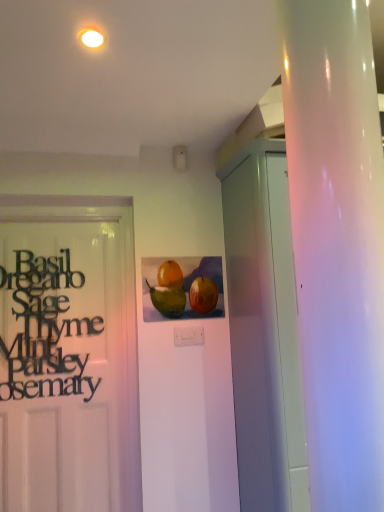
Identify the location of white glossy cabinet at right. pyautogui.click(x=264, y=330).

The width and height of the screenshot is (384, 512). Describe the element at coordinates (43, 328) in the screenshot. I see `black matte sign at left` at that location.

Locate an element on the screen. The height and width of the screenshot is (512, 384). white glossy light fixture at upper center is located at coordinates (92, 38).

The height and width of the screenshot is (512, 384). I want to click on white glossy cabinet at right, so click(264, 330).

Can you see white glossy light fixture at upper center touching white glossy cabinet at right?

white glossy light fixture at upper center and white glossy cabinet at right are not in contact.

The height and width of the screenshot is (512, 384). Identify the location of lighting above the white glossy cabinet at right (from the image's perspective). (92, 38).

From the image's perspective, is white glossy light fixture at upper center above or below white glossy cabinet at right?

white glossy light fixture at upper center is situated higher than white glossy cabinet at right in the image.

Between white glossy cabinet at right and black matte sign at left, which one has smaller width?

black matte sign at left is thinner.

Is white glossy cabinet at right to the left of black matte sign at left from the viewer's perspective?

In fact, white glossy cabinet at right is to the right of black matte sign at left.

Is white glossy cabinet at right positioned with its back to black matte sign at left?

No, white glossy cabinet at right is not facing the opposite direction of black matte sign at left.

Does white glossy cabinet at right have a smaller size compared to black matte sign at left?

No, white glossy cabinet at right is not smaller than black matte sign at left.

Would you say watercolor painting of fruits at center is part of black matte sign at left's contents?

That's incorrect, watercolor painting of fruits at center is not inside black matte sign at left.

Which is closer to the camera, (50, 304) or (183, 298)?

Point (50, 304).

Between black matte sign at left and watercolor painting of fruits at center, which one has smaller width?

With smaller width is black matte sign at left.

How many degrees apart are the facing directions of black matte sign at left and white glossy light fixture at upper center?

There is a 101-degree angle between the facing directions of black matte sign at left and white glossy light fixture at upper center.

Which object is closer to the camera taking this photo, black matte sign at left or white glossy light fixture at upper center?

white glossy light fixture at upper center is closer to the camera.

Is black matte sign at left to the right of white glossy light fixture at upper center from the viewer's perspective?

No, black matte sign at left is not to the right of white glossy light fixture at upper center.

Is black matte sign at left facing away from white glossy light fixture at upper center?

No, black matte sign at left's orientation is not away from white glossy light fixture at upper center.

Could you tell me if black matte sign at left is facing white glossy cabinet at right?

No.

Is the surface of black matte sign at left in direct contact with white glossy cabinet at right?

No, black matte sign at left is not making contact with white glossy cabinet at right.

How distant is black matte sign at left from white glossy cabinet at right?

black matte sign at left is 34.62 inches from white glossy cabinet at right.

Is white glossy cabinet at right inside black matte sign at left?

No, black matte sign at left does not contain white glossy cabinet at right.

From a real-world perspective, is watercolor painting of fruits at center on black matte sign at left?

Correct, in the physical world, watercolor painting of fruits at center is higher than black matte sign at left.

Could you tell me if watercolor painting of fruits at center is turned towards black matte sign at left?

No, watercolor painting of fruits at center is not oriented towards black matte sign at left.

From the image's perspective, is watercolor painting of fruits at center above or below black matte sign at left?

Based on their image positions, watercolor painting of fruits at center is located above black matte sign at left.

Is white glossy cabinet at right positioned beyond the bounds of watercolor painting of fruits at center?

Indeed, white glossy cabinet at right is completely outside watercolor painting of fruits at center.

Which object is positioned more to the left, white glossy cabinet at right or watercolor painting of fruits at center?

watercolor painting of fruits at center.

Could you tell me if white glossy cabinet at right is turned towards watercolor painting of fruits at center?

No, white glossy cabinet at right is not facing towards watercolor painting of fruits at center.

At what (x,y) coordinates should I click in order to perform the action: click on lighting located above the white glossy cabinet at right (from the image's perspective). Please return your answer as a coordinate pair (x, y). Looking at the image, I should click on (92, 38).

This screenshot has height=512, width=384. I want to click on garage door below the black matte sign at left (from the image's perspective), so click(264, 330).

From the picture: Looking at the image, which one is located closer to watercolor painting of fruits at center, white glossy cabinet at right or white glossy light fixture at upper center?

The object closer to watercolor painting of fruits at center is white glossy cabinet at right.

In the scene shown: Looking at the image, which one is located closer to black matte sign at left, watercolor painting of fruits at center or white glossy light fixture at upper center?

watercolor painting of fruits at center is positioned closer to the anchor black matte sign at left.

When comparing their distances from white glossy cabinet at right, does black matte sign at left or white glossy light fixture at upper center seem further?

The object further to white glossy cabinet at right is white glossy light fixture at upper center.

Considering their positions, is watercolor painting of fruits at center positioned closer to white glossy light fixture at upper center than white glossy cabinet at right?

watercolor painting of fruits at center.

Which object lies nearer to the anchor point white glossy light fixture at upper center, white glossy cabinet at right or watercolor painting of fruits at center?

The object closer to white glossy light fixture at upper center is watercolor painting of fruits at center.

When comparing their distances from white glossy light fixture at upper center, does white glossy cabinet at right or black matte sign at left seem closer?

white glossy cabinet at right.

Based on their spatial positions, is white glossy light fixture at upper center or white glossy cabinet at right further from watercolor painting of fruits at center?

The object further to watercolor painting of fruits at center is white glossy light fixture at upper center.

Considering their positions, is watercolor painting of fruits at center positioned closer to white glossy light fixture at upper center than black matte sign at left?

watercolor painting of fruits at center is closer to white glossy light fixture at upper center.

Locate an element on the screen. This screenshot has width=384, height=512. fruit between white glossy light fixture at upper center and black matte sign at left from top to bottom is located at coordinates (183, 288).

This screenshot has height=512, width=384. Identify the location of fruit between black matte sign at left and white glossy cabinet at right from left to right. (183, 288).

Identify the location of fruit between white glossy light fixture at upper center and white glossy cabinet at right in the up-down direction. (183, 288).

The image size is (384, 512). In order to click on lettering between white glossy light fixture at upper center and white glossy cabinet at right in the up-down direction in this screenshot , I will do `click(43, 328)`.